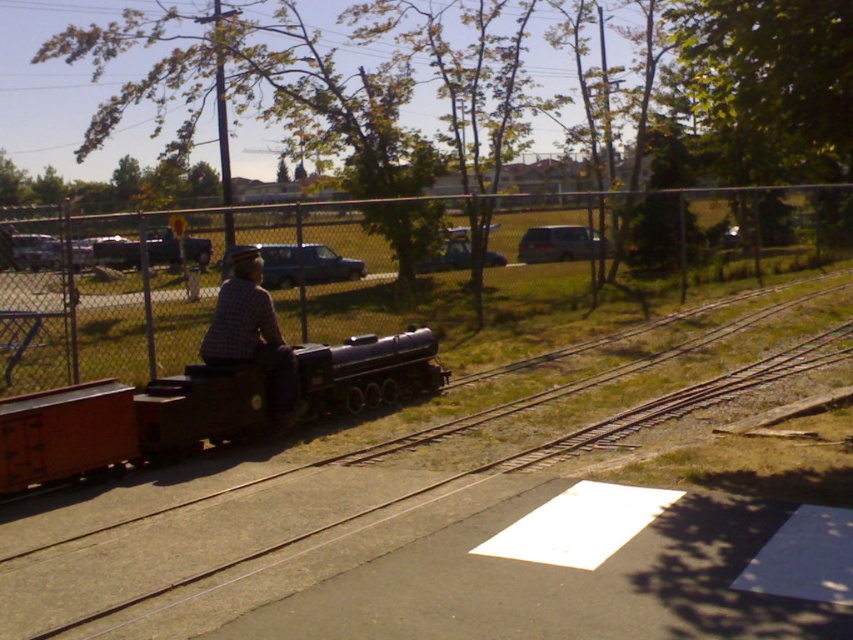
Does matte silver suv at center have a greater height compared to metallic blue car at center?

Yes.

Describe the element at coordinates (560, 243) in the screenshot. I see `matte silver suv at center` at that location.

Describe the element at coordinates (560, 243) in the screenshot. I see `matte silver suv at center` at that location.

Identify the location of matte silver suv at center. (560, 243).

Does shiny black locomotive at center have a larger size compared to plaid fabric shirt at center?

Yes, shiny black locomotive at center is bigger than plaid fabric shirt at center.

Which is more to the left, shiny black locomotive at center or plaid fabric shirt at center?

plaid fabric shirt at center

Find the location of `shiny black locomotive at center`. shiny black locomotive at center is located at coordinates (196, 410).

Does plaid fabric shirt at center have a greater width compared to metallic blue car at center?

Correct, the width of plaid fabric shirt at center exceeds that of metallic blue car at center.

Is plaid fabric shirt at center to the left of metallic blue car at center from the viewer's perspective?

Yes, plaid fabric shirt at center is to the left of metallic blue car at center.

Where is `plaid fabric shirt at center`? Image resolution: width=853 pixels, height=640 pixels. plaid fabric shirt at center is located at coordinates (252, 333).